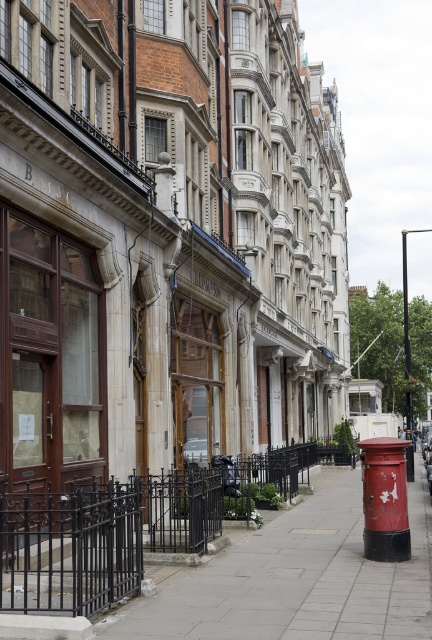
You are standing on the smooth concrete pavement at center and want to walk towards the black wrought iron fence at lower center. How many steps do you need to take to reach it?

The smooth concrete pavement at center is closer to the viewer than the black wrought iron fence at lower center, so you would need to take a few steps forward to reach it.

You are a delivery robot positioned at the origin point of the coordinate system. You need to deliver a package to the smooth concrete pavement at center. What are the coordinates you should move towards?

The coordinates to move towards are 0.905 in the x direction and 0.685 in the y direction.

You are a delivery person with a cart that is 6 feet wide. You need to navigate through the street shown in the image. Can your cart fit between the smooth concrete pavement at center and the black wrought iron fence at lower center?

The smooth concrete pavement at center and the black wrought iron fence at lower center are 5.25 feet apart from each other. Since the cart is 6 feet wide, it cannot fit through the space between them.